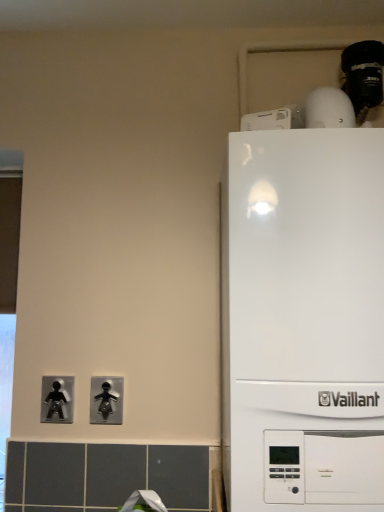
Question: Looking at the image, does black plastic light switch at lower center, the second light switch from the left, seem bigger or smaller compared to metallic silver figure at lower left, which is the 1th light switch in left-to-right order?

Choices:
 (A) big
 (B) small

Answer: (B)

Question: Relative to metallic silver figure at lower left, arranged as the 2th light switch when viewed from the right, is black plastic light switch at lower center, the second light switch from the left, in front or behind?

Choices:
 (A) front
 (B) behind

Answer: (A)

Question: Based on their relative distances, which object is farther from the white glossy boiler at right?

Choices:
 (A) metallic silver figure at lower left, which is the 1th light switch in left-to-right order
 (B) black plastic light switch at lower center, which is the first light switch in right-to-left order

Answer: (A)

Question: Estimate the real-world distances between objects in this image. Which object is farther from the metallic silver figure at lower left, which is the 1th light switch in left-to-right order?

Choices:
 (A) black plastic light switch at lower center, which is the first light switch in right-to-left order
 (B) white glossy boiler at right

Answer: (B)